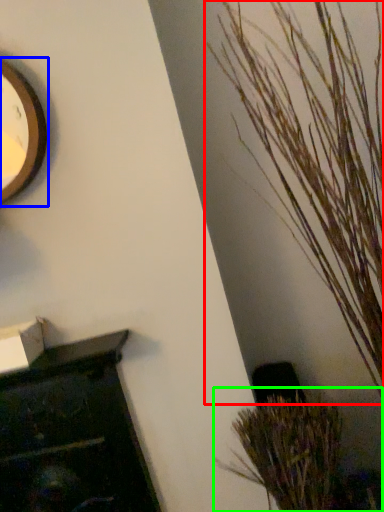
Question: Based on their relative distances, which object is nearer to houseplant (highlighted by a red box)? Choose from clock (highlighted by a blue box) and houseplant (highlighted by a green box).

Choices:
 (A) clock
 (B) houseplant

Answer: (B)